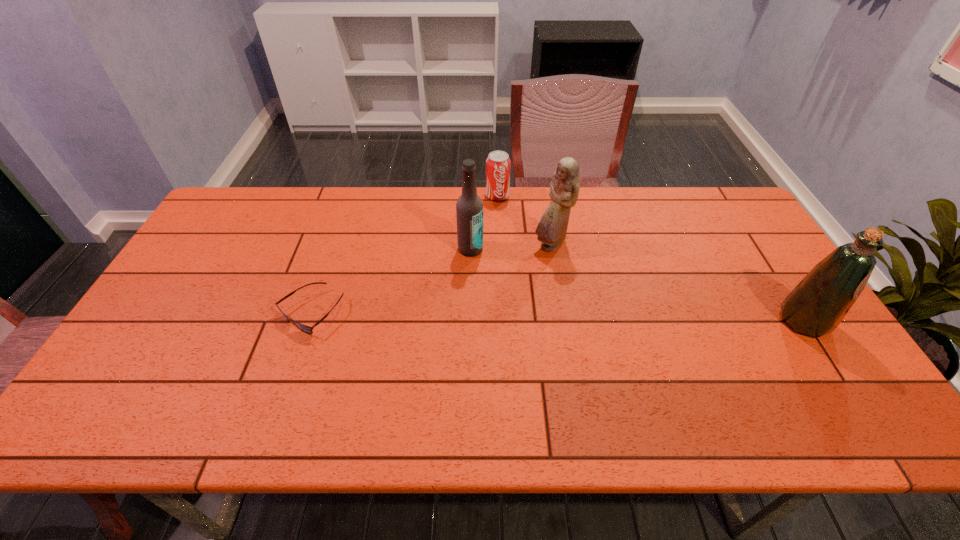
At what (x,y) coordinates should I click in order to perform the action: click on vacant area at the near edge of the desktop. Please return your answer as a coordinate pair (x, y). The width and height of the screenshot is (960, 540). Looking at the image, I should click on (728, 366).

What are the coordinates of `vacant area at the left edge` in the screenshot? It's located at (180, 355).

Image resolution: width=960 pixels, height=540 pixels. Find the location of `vacant area at the right edge`. vacant area at the right edge is located at coordinates (750, 245).

Identify the location of vacant area at the far left corner of the desktop. (240, 217).

In the image, there is a desktop. Where is `vacant space at the near left corner`? vacant space at the near left corner is located at coordinates (117, 368).

The width and height of the screenshot is (960, 540). Find the location of `free spot at the far right corner of the desktop`. free spot at the far right corner of the desktop is located at coordinates (700, 219).

This screenshot has width=960, height=540. In order to click on free space between the fourth object from right to left and the olive oil in this screenshot , I will do `click(637, 285)`.

Locate an element on the screen. The width and height of the screenshot is (960, 540). vacant space in between the fourth object from left to right and the rightmost object is located at coordinates tap(677, 284).

What are the coordinates of `vacant space that is in between the leftmost object and the third object from left to right` in the screenshot? It's located at (404, 254).

The width and height of the screenshot is (960, 540). In order to click on vacant space in between the leftmost object and the farthest object in this screenshot , I will do `click(404, 254)`.